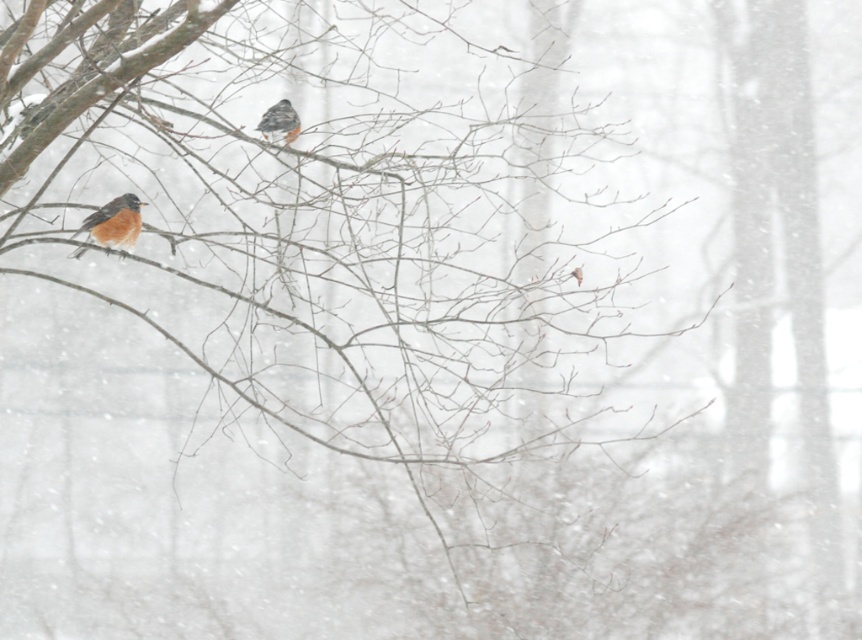
Which of these two, bright orange bird at left or speckled feathered bird at upper center, stands shorter?

Standing shorter between the two is speckled feathered bird at upper center.

Who is positioned more to the right, bright orange bird at left or speckled feathered bird at upper center?

Positioned to the right is speckled feathered bird at upper center.

The height and width of the screenshot is (640, 862). Describe the element at coordinates (114, 221) in the screenshot. I see `bright orange bird at left` at that location.

Locate an element on the screen. bright orange bird at left is located at coordinates (114, 221).